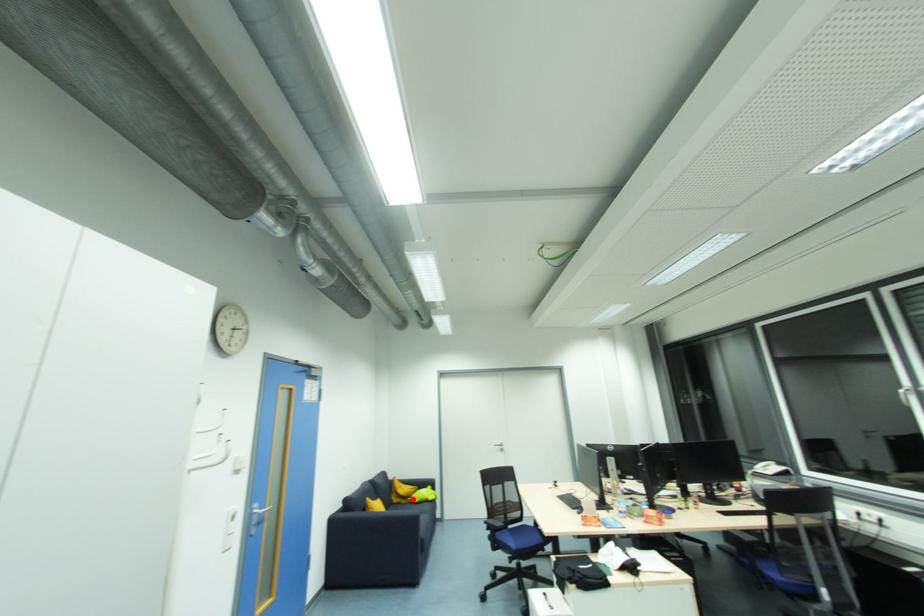
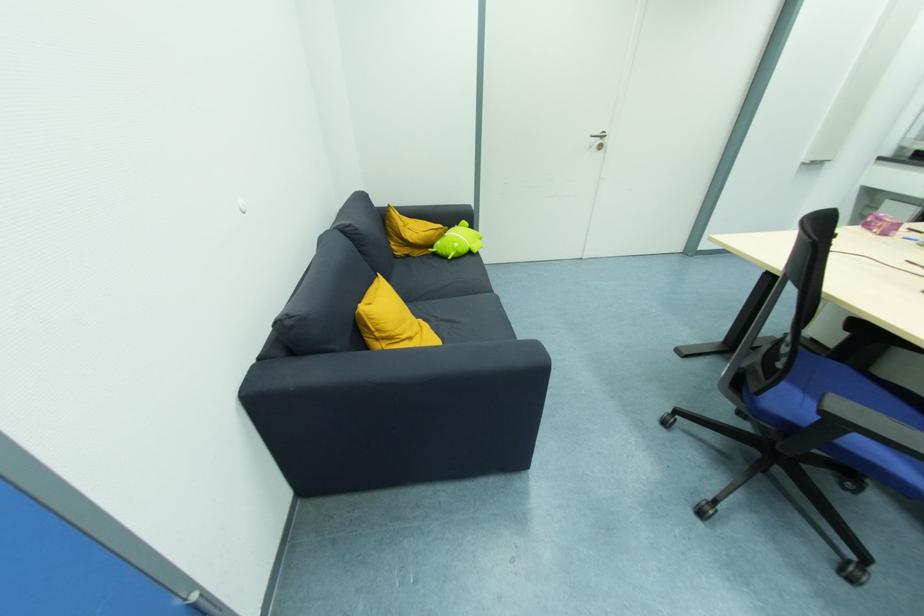
Question: I am providing you with two images of the same scene from different viewpoints. Given a red point in image1, look at the same physical point in image2. Is it:

Choices:
 (A) Closer to the viewpoint
 (B) Farther from the viewpoint

Answer: (A)